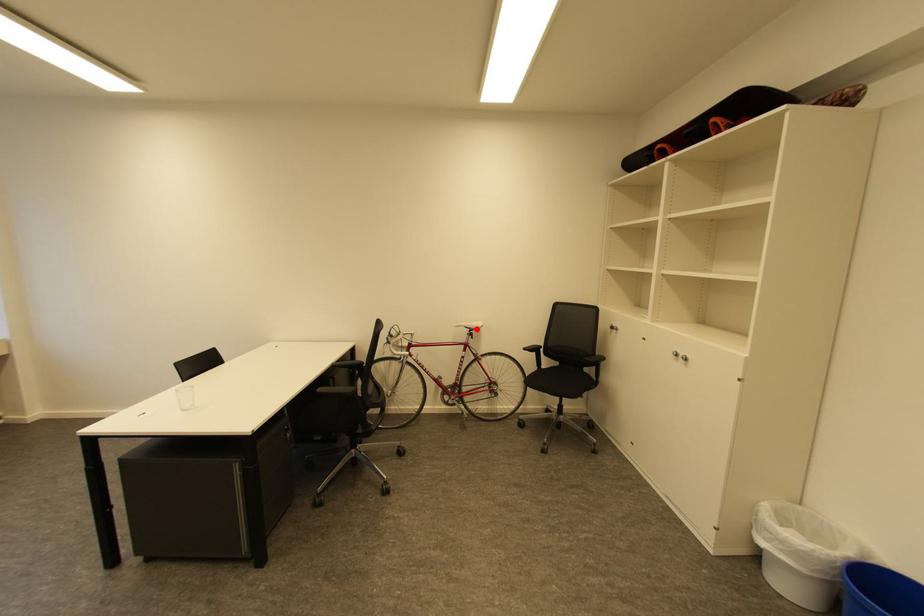
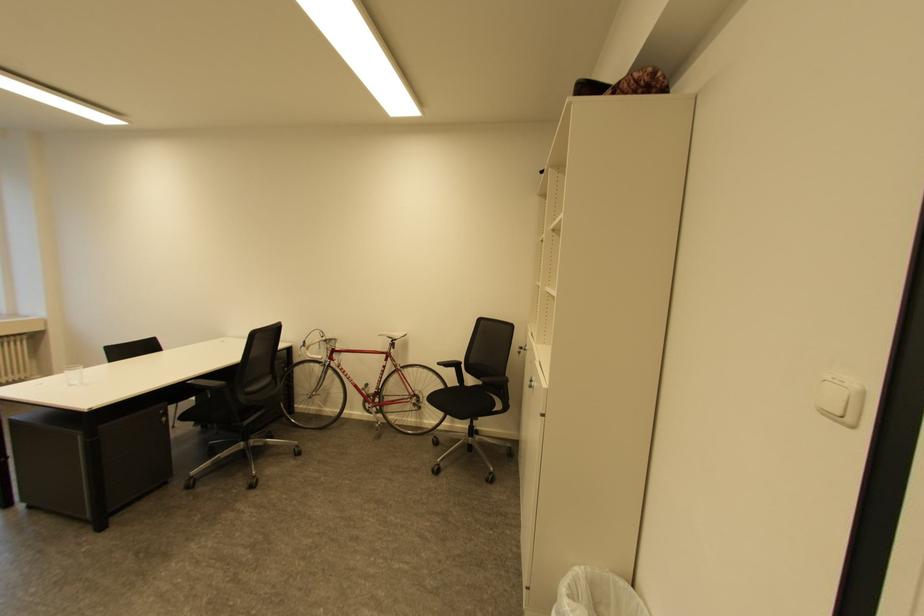
Find the pixel in the second image that matches the highlighted location in the first image.

(398, 339)